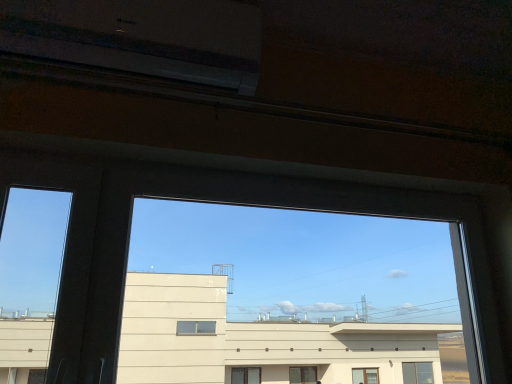
Question: Is white plastic air conditioning unit at upper left in front of or behind transparent glass window at center in the image?

Choices:
 (A) behind
 (B) front

Answer: (A)

Question: From a real-world perspective, is white plastic air conditioning unit at upper left physically located above or below transparent glass window at center?

Choices:
 (A) below
 (B) above

Answer: (B)

Question: From the image's perspective, relative to transparent glass window at center, is white plastic air conditioning unit at upper left above or below?

Choices:
 (A) below
 (B) above

Answer: (B)

Question: Is transparent glass window at center situated inside white plastic air conditioning unit at upper left or outside?

Choices:
 (A) inside
 (B) outside

Answer: (B)

Question: Would you say transparent glass window at center is to the left or to the right of white plastic air conditioning unit at upper left in the picture?

Choices:
 (A) right
 (B) left

Answer: (A)

Question: Considering their positions, is transparent glass window at center located in front of or behind white plastic air conditioning unit at upper left?

Choices:
 (A) behind
 (B) front

Answer: (B)

Question: Is point (432, 352) closer or farther from the camera than point (48, 41)?

Choices:
 (A) closer
 (B) farther

Answer: (B)